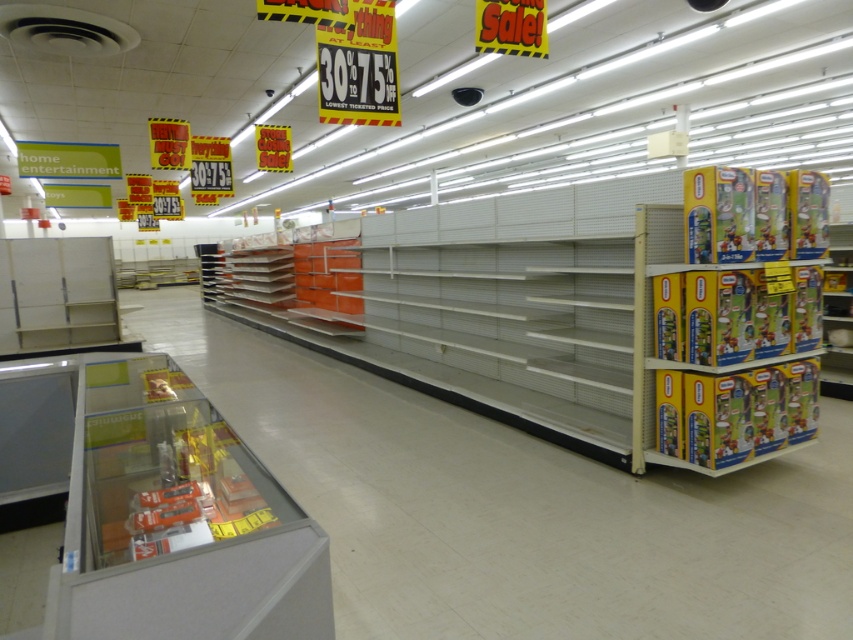
Consider the image. You are a customer in the store and want to find the yellow cardboard toy at right and the yellow cardboard boxes at right. According to the scene description, which one is located more to the right side?

The yellow cardboard toy at right is positioned on the right side of yellow cardboard boxes at right, so the yellow cardboard toy at right is more to the right side.